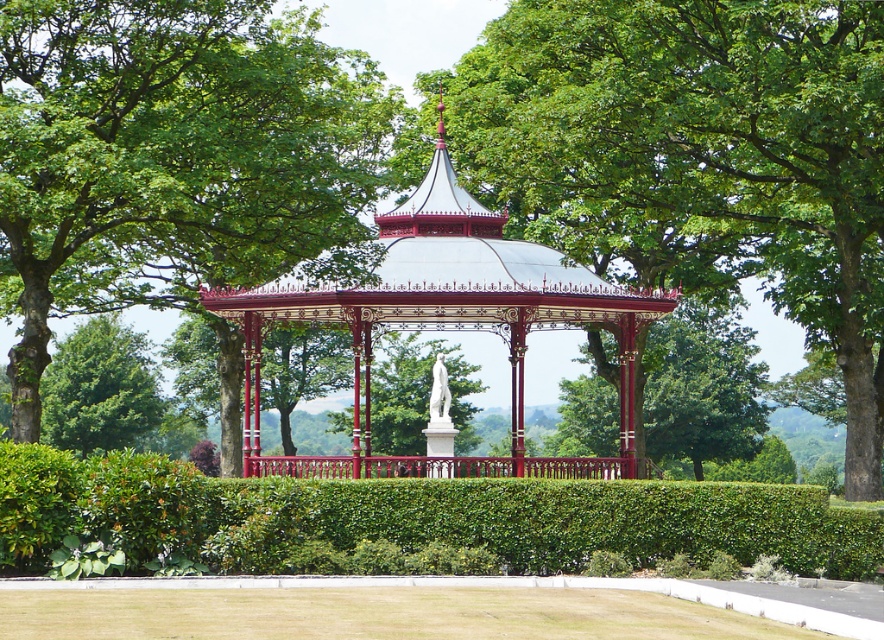
Question: Can you confirm if green leafy tree at upper center is smaller than green leafy hedge at center?

Choices:
 (A) yes
 (B) no

Answer: (B)

Question: Can you confirm if green leafy hedge at center is positioned to the right of metallic gazebo at center?

Choices:
 (A) no
 (B) yes

Answer: (B)

Question: Which point appears closest to the camera in this image?

Choices:
 (A) (859, 291)
 (B) (219, 141)
 (C) (389, 486)

Answer: (C)

Question: Which object appears farthest from the camera in this image?

Choices:
 (A) green leafy hedge at center
 (B) green leafy tree at center
 (C) green leafy tree at upper center
 (D) metallic gazebo at center

Answer: (D)

Question: Can you confirm if green leafy tree at upper center is positioned to the left of green leafy hedge at center?

Choices:
 (A) no
 (B) yes

Answer: (B)

Question: Estimate the real-world distances between objects in this image. Which object is closer to the metallic gazebo at center?

Choices:
 (A) green leafy hedge at center
 (B) green leafy tree at center
 (C) green leafy tree at upper center

Answer: (C)